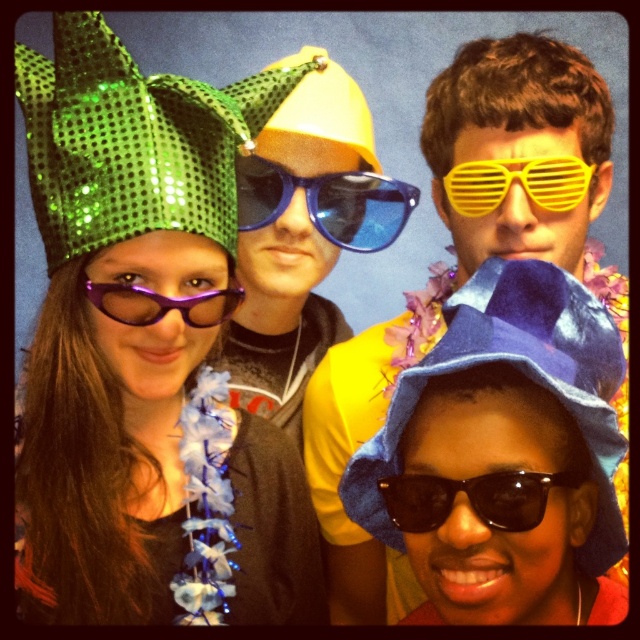
Question: In this image, where is velvet blue hat at lower right located relative to yellow plastic goggles at upper right?

Choices:
 (A) below
 (B) above

Answer: (A)

Question: Which point is closer to the camera taking this photo?

Choices:
 (A) (525, 177)
 (B) (97, 294)
 (C) (72, 36)

Answer: (C)

Question: In this image, where is yellow plastic sunglasses at upper center located relative to velvet blue hat at lower right?

Choices:
 (A) below
 (B) above

Answer: (B)

Question: Which is farther from the matte purple sunglasses at upper left?

Choices:
 (A) purple matte goggles at left
 (B) yellow plastic sunglasses at upper center

Answer: (B)

Question: Which object appears closest to the camera in this image?

Choices:
 (A) velvet blue hat at lower right
 (B) green sequined hat at upper left
 (C) matte purple sunglasses at upper left

Answer: (A)

Question: Can you confirm if black plastic sunglasses at lower center is positioned above purple matte goggles at left?

Choices:
 (A) no
 (B) yes

Answer: (A)